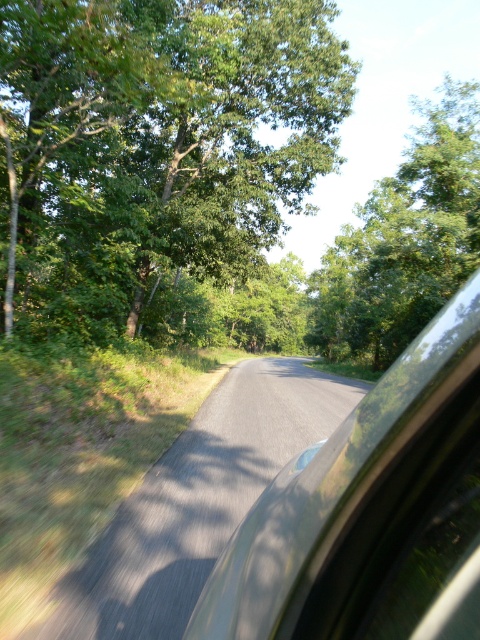
Which is more to the right, green leafy tree at upper center or metallic silver car at center?

metallic silver car at center is more to the right.

Does green leafy tree at upper center have a lesser width compared to metallic silver car at center?

In fact, green leafy tree at upper center might be wider than metallic silver car at center.

Between point (187, 58) and point (384, 625), which one is positioned in front?

Point (384, 625) is in front.

Identify the location of green leafy tree at upper center. (156, 144).

Between green leafy tree at upper center and green leafy tree at upper right, which one appears on the left side from the viewer's perspective?

green leafy tree at upper center

Is point (230, 248) positioned behind point (448, 289)?

No, (230, 248) is in front of (448, 289).

Image resolution: width=480 pixels, height=640 pixels. What are the coordinates of `green leafy tree at upper center` in the screenshot? It's located at (156, 144).

Image resolution: width=480 pixels, height=640 pixels. In order to click on green leafy tree at upper center in this screenshot , I will do `click(156, 144)`.

Is point (242, 620) more distant than point (441, 248)?

No, it is in front of (441, 248).

Does point (267, 497) lie in front of point (466, 253)?

Yes, point (267, 497) is closer to viewer.

Who is more distant from viewer, (462, 557) or (330, 330)?

Point (330, 330)

The width and height of the screenshot is (480, 640). What are the coordinates of `metallic silver car at center` in the screenshot? It's located at (364, 508).